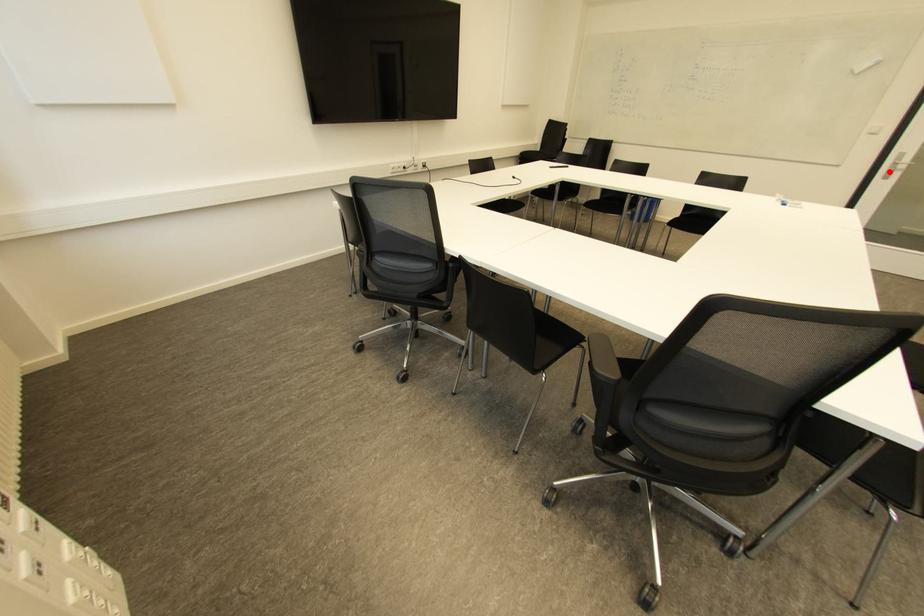
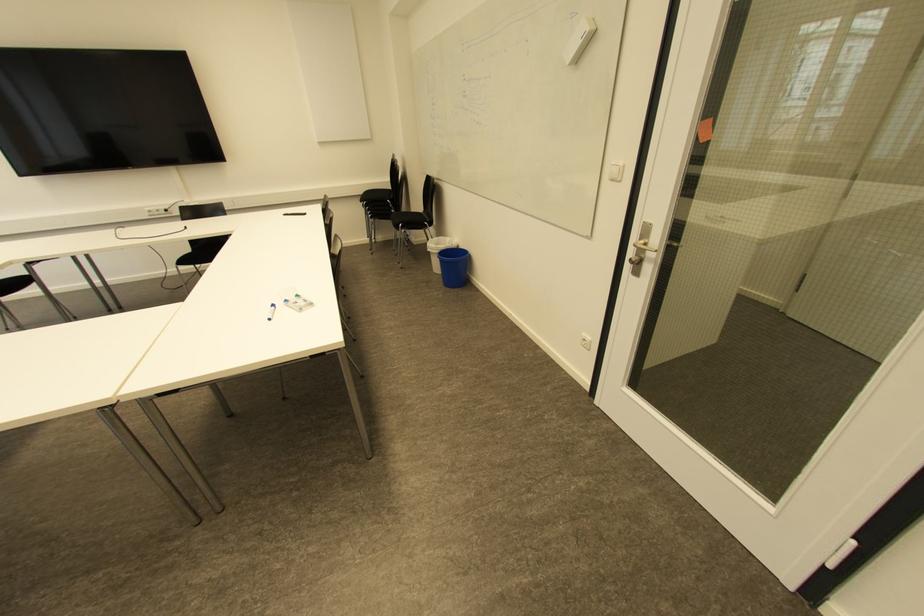
Where in the second image is the point corresponding to the highlighted location from the first image?

(638, 262)